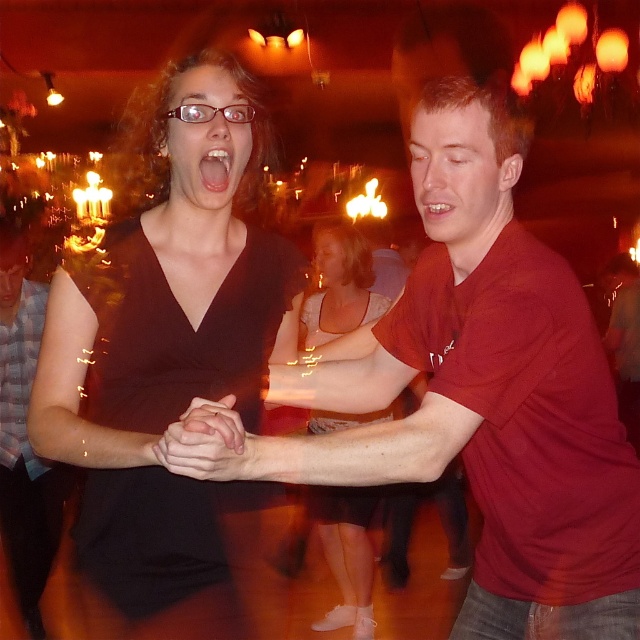
Who is more forward, (234, 416) or (307, 317)?

Point (234, 416) is more forward.

Where is `matte red t-shirt at center`? The height and width of the screenshot is (640, 640). matte red t-shirt at center is located at coordinates (474, 394).

Is point (241, 497) positioned behind point (340, 518)?

No, it is not.

Who is more forward, (x=184, y=120) or (x=340, y=502)?

Point (x=184, y=120)

In order to click on black matte dress at center in this screenshot , I will do point(168,353).

Is matte red t-shirt at center to the right of black matte dress at center from the viewer's perspective?

Yes, matte red t-shirt at center is to the right of black matte dress at center.

Where is `matte red t-shirt at center`? matte red t-shirt at center is located at coordinates (474, 394).

Locate an element on the screen. matte red t-shirt at center is located at coordinates (474, 394).

Locate an element on the screen. matte red t-shirt at center is located at coordinates (474, 394).